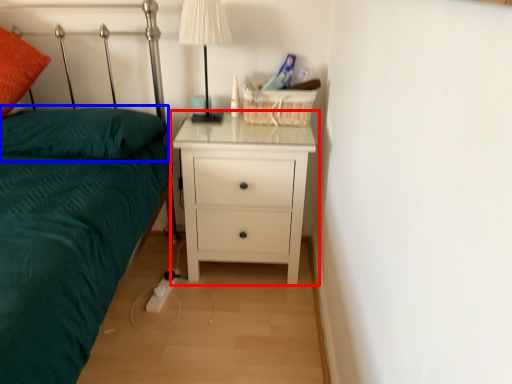
Question: Among these objects, which one is nearest to the camera, nightstand (highlighted by a red box) or pillow (highlighted by a blue box)?

Choices:
 (A) nightstand
 (B) pillow

Answer: (B)